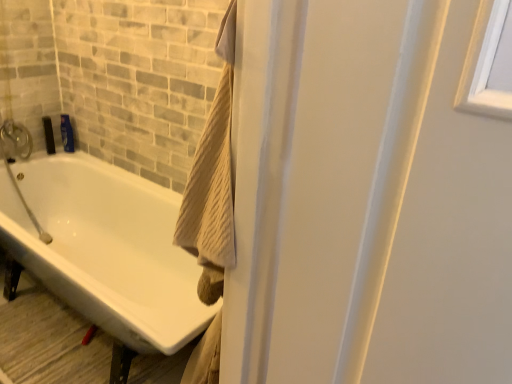
The width and height of the screenshot is (512, 384). What do you see at coordinates (67, 133) in the screenshot?
I see `blue glossy shampoo bottle at upper left` at bounding box center [67, 133].

Image resolution: width=512 pixels, height=384 pixels. I want to click on blue glossy shampoo bottle at upper left, so click(67, 133).

Find the location of a particular element. This screenshot has width=512, height=384. white glossy bathtub at lower left is located at coordinates (106, 248).

In the scene shown: What is the approximate height of white glossy bathtub at lower left?

white glossy bathtub at lower left is 22.76 inches in height.

Describe the element at coordinates (106, 248) in the screenshot. I see `white glossy bathtub at lower left` at that location.

Where is `blue glossy shampoo bottle at upper left`? Image resolution: width=512 pixels, height=384 pixels. blue glossy shampoo bottle at upper left is located at coordinates click(x=67, y=133).

Based on the photo, considering the relative positions of blue glossy shampoo bottle at upper left and white glossy bathtub at lower left in the image provided, is blue glossy shampoo bottle at upper left to the right of white glossy bathtub at lower left from the viewer's perspective?

In fact, blue glossy shampoo bottle at upper left is to the left of white glossy bathtub at lower left.

Is blue glossy shampoo bottle at upper left in front of white glossy bathtub at lower left?

No, the depth of blue glossy shampoo bottle at upper left is greater than that of white glossy bathtub at lower left.

Is point (67, 131) closer or farther from the camera than point (101, 314)?

Point (67, 131) is farther from the camera than point (101, 314).

From the image's perspective, is blue glossy shampoo bottle at upper left over white glossy bathtub at lower left?

Yes, from the image's perspective, blue glossy shampoo bottle at upper left is on top of white glossy bathtub at lower left.

From a real-world perspective, between blue glossy shampoo bottle at upper left and white glossy bathtub at lower left, who is vertically lower?

From a 3D spatial view, white glossy bathtub at lower left is below.

Considering the sizes of objects blue glossy shampoo bottle at upper left and white glossy bathtub at lower left in the image provided, who is wider, blue glossy shampoo bottle at upper left or white glossy bathtub at lower left?

white glossy bathtub at lower left is wider.

Between blue glossy shampoo bottle at upper left and white glossy bathtub at lower left, which one has more height?

Standing taller between the two is white glossy bathtub at lower left.

Considering the relative sizes of blue glossy shampoo bottle at upper left and white glossy bathtub at lower left in the image provided, is blue glossy shampoo bottle at upper left bigger than white glossy bathtub at lower left?

Actually, blue glossy shampoo bottle at upper left might be smaller than white glossy bathtub at lower left.

Would you say blue glossy shampoo bottle at upper left contains white glossy bathtub at lower left?

No, white glossy bathtub at lower left is not a part of blue glossy shampoo bottle at upper left.

Is blue glossy shampoo bottle at upper left not near white glossy bathtub at lower left?

No, blue glossy shampoo bottle at upper left is in close proximity to white glossy bathtub at lower left.

Is blue glossy shampoo bottle at upper left facing towards white glossy bathtub at lower left?

No, blue glossy shampoo bottle at upper left does not turn towards white glossy bathtub at lower left.

How different are the orientations of blue glossy shampoo bottle at upper left and white glossy bathtub at lower left in degrees?

blue glossy shampoo bottle at upper left and white glossy bathtub at lower left are facing 0.000113 degrees away from each other.

How much distance is there between blue glossy shampoo bottle at upper left and white glossy bathtub at lower left?

blue glossy shampoo bottle at upper left is 21.68 inches from white glossy bathtub at lower left.

Find the location of a particular element. This screenshot has height=384, width=512. toiletry on the left of the white glossy bathtub at lower left is located at coordinates (67, 133).

Is white glossy bathtub at lower left to the right of blue glossy shampoo bottle at upper left from the viewer's perspective?

Correct, you'll find white glossy bathtub at lower left to the right of blue glossy shampoo bottle at upper left.

Between white glossy bathtub at lower left and blue glossy shampoo bottle at upper left, which one is positioned in front?

white glossy bathtub at lower left is in front.

Looking at this image, which point is more forward, (154, 249) or (67, 149)?

The point (154, 249) is more forward.

From the image's perspective, is white glossy bathtub at lower left above blue glossy shampoo bottle at upper left?

No, from the image's perspective, white glossy bathtub at lower left is not over blue glossy shampoo bottle at upper left.

From a real-world perspective, is white glossy bathtub at lower left located beneath blue glossy shampoo bottle at upper left?

Yes, from a real-world perspective, white glossy bathtub at lower left is under blue glossy shampoo bottle at upper left.

Which object is thinner, white glossy bathtub at lower left or blue glossy shampoo bottle at upper left?

Thinner between the two is blue glossy shampoo bottle at upper left.

In terms of height, does white glossy bathtub at lower left look taller or shorter compared to blue glossy shampoo bottle at upper left?

white glossy bathtub at lower left is taller than blue glossy shampoo bottle at upper left.

Looking at this image, is white glossy bathtub at lower left bigger than blue glossy shampoo bottle at upper left?

Yes, white glossy bathtub at lower left is bigger than blue glossy shampoo bottle at upper left.

Is white glossy bathtub at lower left inside or outside of blue glossy shampoo bottle at upper left?

The correct answer is: outside.

Can you see white glossy bathtub at lower left touching blue glossy shampoo bottle at upper left?

white glossy bathtub at lower left and blue glossy shampoo bottle at upper left are clearly separated.

Is white glossy bathtub at lower left turned away from blue glossy shampoo bottle at upper left?

No, blue glossy shampoo bottle at upper left is not at the back of white glossy bathtub at lower left.

At what (x,y) coordinates should I click in order to perform the action: click on toiletry to the left of white glossy bathtub at lower left. Please return your answer as a coordinate pair (x, y). The width and height of the screenshot is (512, 384). Looking at the image, I should click on (67, 133).

Where is `toiletry above the white glossy bathtub at lower left (from the image's perspective)`? toiletry above the white glossy bathtub at lower left (from the image's perspective) is located at coordinates coord(67,133).

The height and width of the screenshot is (384, 512). In the image, there is a blue glossy shampoo bottle at upper left. In order to click on bathtub below it (from a real-world perspective) in this screenshot , I will do `click(106, 248)`.